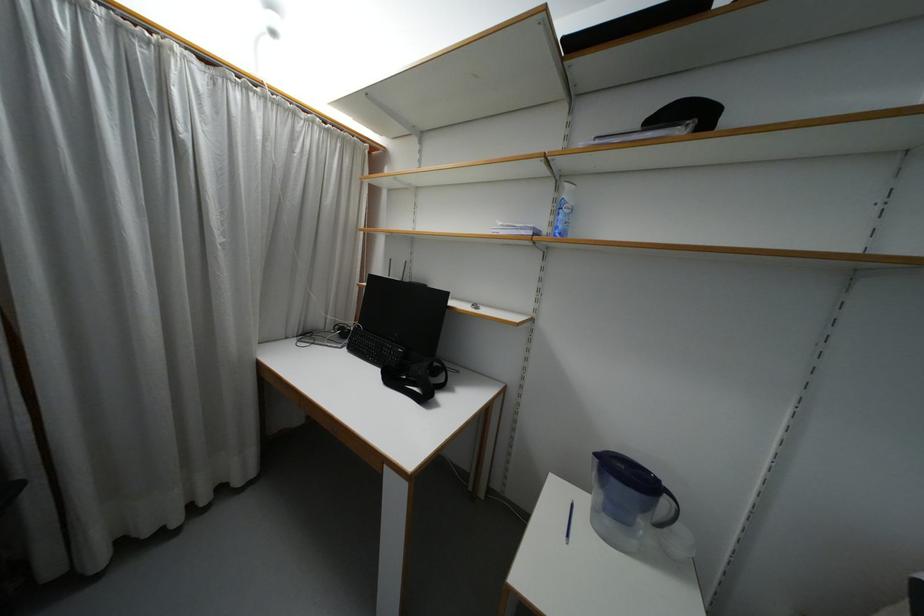
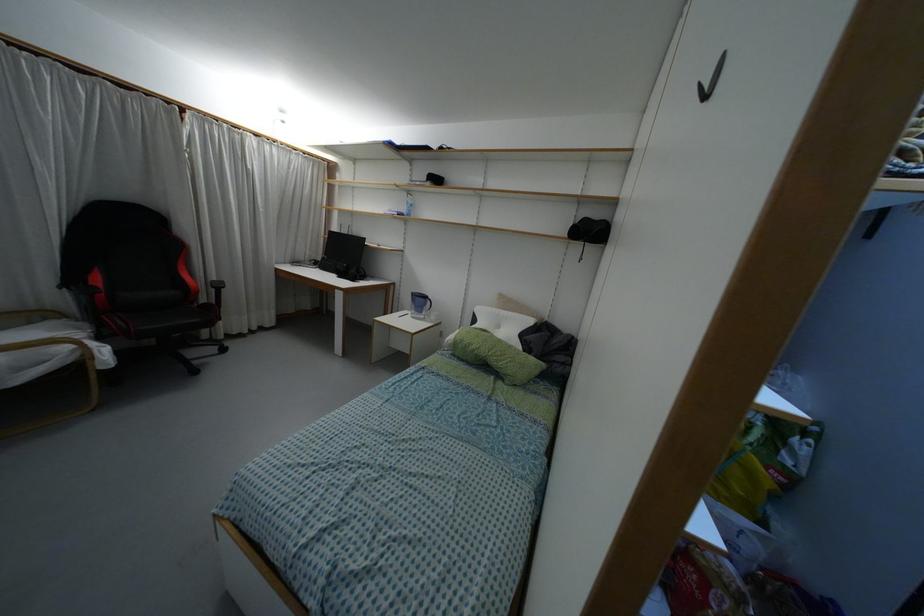
In the second image, find the point that corresponds to the point at 393,378 in the first image.

(341, 275)